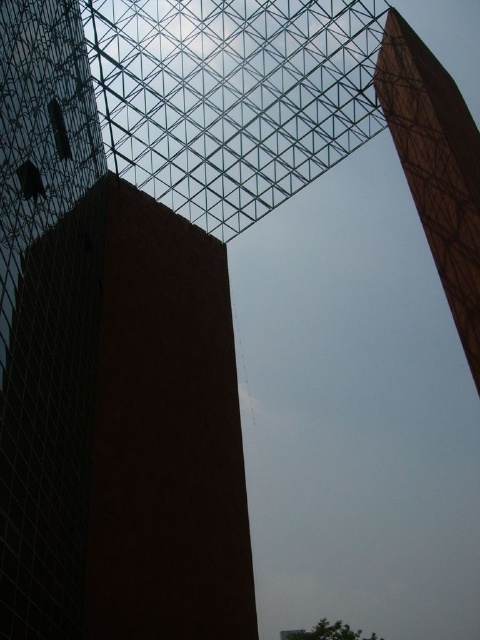
Question: Which point is farther to the camera?

Choices:
 (A) (417, 67)
 (B) (73, 634)

Answer: (A)

Question: Does brown brick tower at center have a lesser width compared to wooden tower at upper right?

Choices:
 (A) no
 (B) yes

Answer: (A)

Question: Is brown brick tower at center positioned before wooden tower at upper right?

Choices:
 (A) yes
 (B) no

Answer: (A)

Question: Is brown brick tower at center further to camera compared to wooden tower at upper right?

Choices:
 (A) no
 (B) yes

Answer: (A)

Question: Which object is farther from the camera taking this photo?

Choices:
 (A) brown brick tower at center
 (B) wooden tower at upper right

Answer: (B)